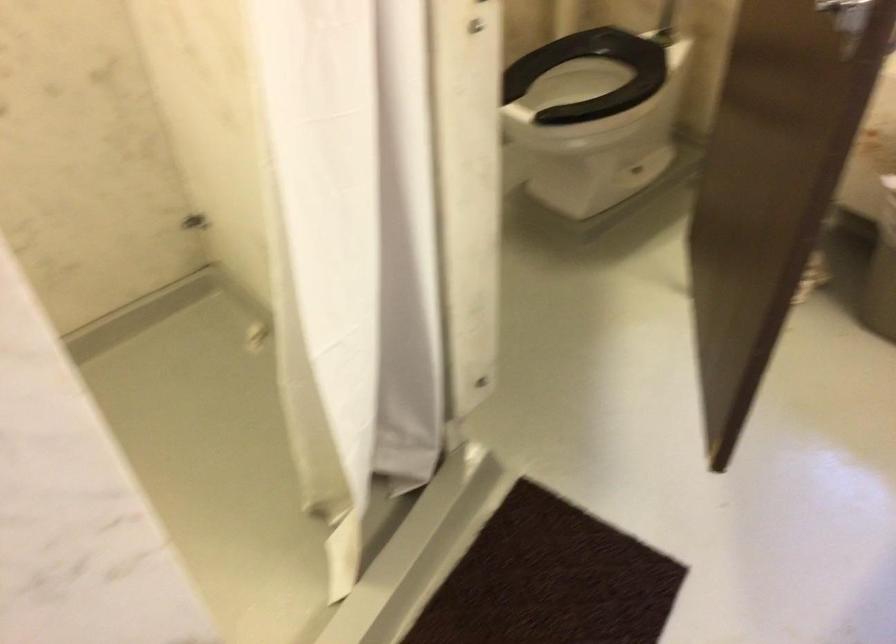
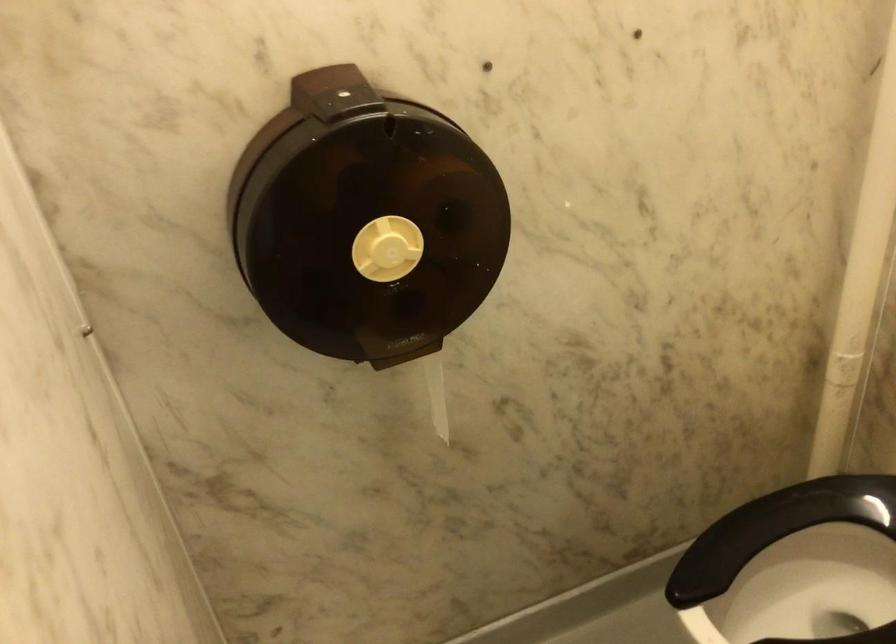
Question: The images are taken continuously from a first-person perspective. In which direction is your viewpoint rotating?

Choices:
 (A) Left
 (B) Right
 (C) Up
 (D) Down

Answer: (A)